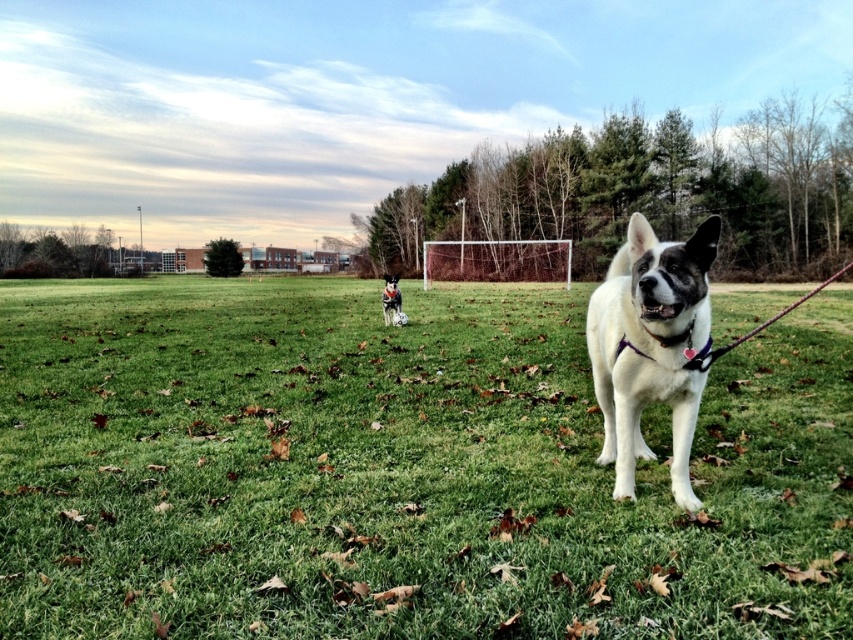
Between green grass at center and black and white fur at center, which one has more height?

black and white fur at center

Between green grass at center and black and white fur at center, which one appears on the left side from the viewer's perspective?

black and white fur at center

This screenshot has width=853, height=640. I want to click on green grass at center, so click(399, 468).

Where is `green grass at center`? This screenshot has width=853, height=640. green grass at center is located at coordinates (399, 468).

In the scene shown: Who is positioned more to the right, white fur dog at center or black and white fur at center?

white fur dog at center is more to the right.

Does point (624, 492) come behind point (397, 275)?

No, (624, 492) is closer to viewer.

What are the coordinates of `white fur dog at center` in the screenshot? It's located at (650, 346).

Does green grass at center have a lesser height compared to white fur dog at center?

No, green grass at center is not shorter than white fur dog at center.

This screenshot has height=640, width=853. What are the coordinates of `green grass at center` in the screenshot? It's located at (399, 468).